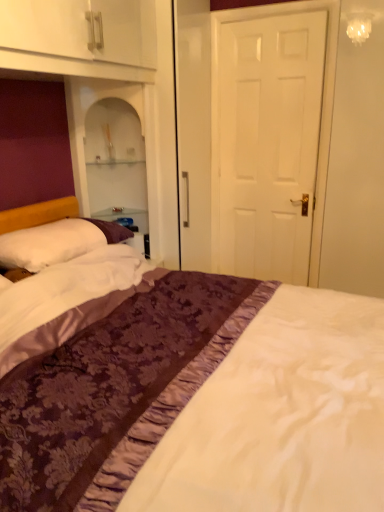
Question: Which is correct: white soft pillow at left is inside white matte door at center, or outside of it?

Choices:
 (A) inside
 (B) outside

Answer: (B)

Question: Looking at their shapes, would you say white soft pillow at left is wider or thinner than white matte door at center?

Choices:
 (A) thin
 (B) wide

Answer: (B)

Question: Which is nearer to the purple satin bed at center?

Choices:
 (A) white matte door at center
 (B) white soft pillow at left

Answer: (B)

Question: Estimate the real-world distances between objects in this image. Which object is closer to the white matte door at center?

Choices:
 (A) white soft pillow at left
 (B) purple satin bed at center

Answer: (A)